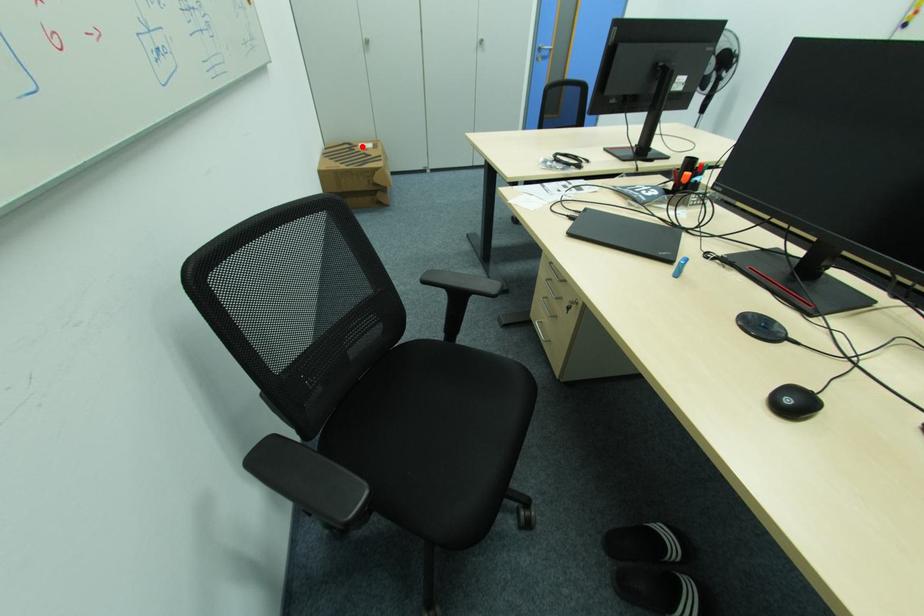
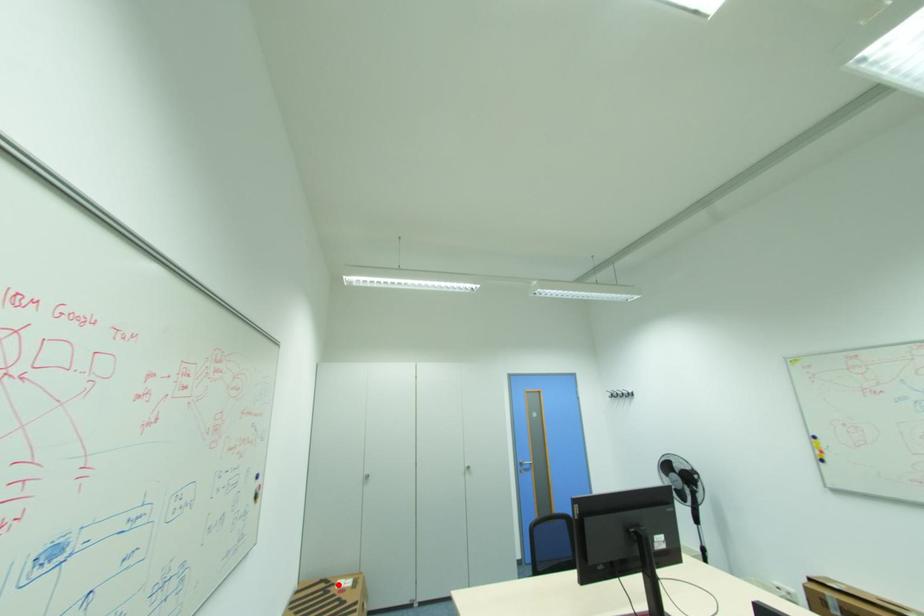
I am providing you with two images of the same scene from different viewpoints. A red point is marked on the first image and another point is marked on the second image. Do the highlighted points in image1 and image2 indicate the same real-world spot?

Yes